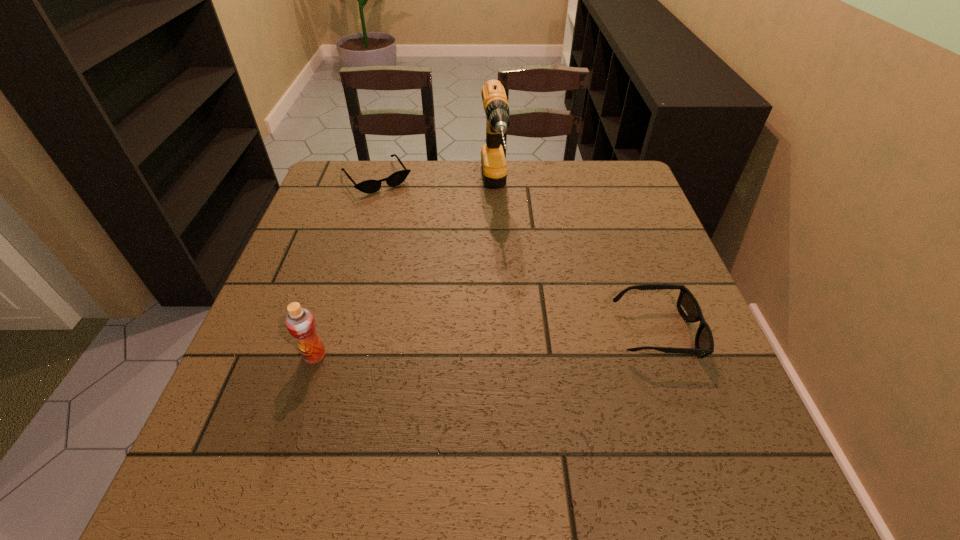
Find the location of a particular element. The height and width of the screenshot is (540, 960). free spot on the desktop that is between the second tallest object and the second shortest object and is positioned at the tip of the drill is located at coordinates (518, 342).

Where is `vacant spot on the desktop that is between the second tallest object and the rightmost object and is positioned on the front-facing side of the shorter sunglasses`? vacant spot on the desktop that is between the second tallest object and the rightmost object and is positioned on the front-facing side of the shorter sunglasses is located at coordinates (501, 343).